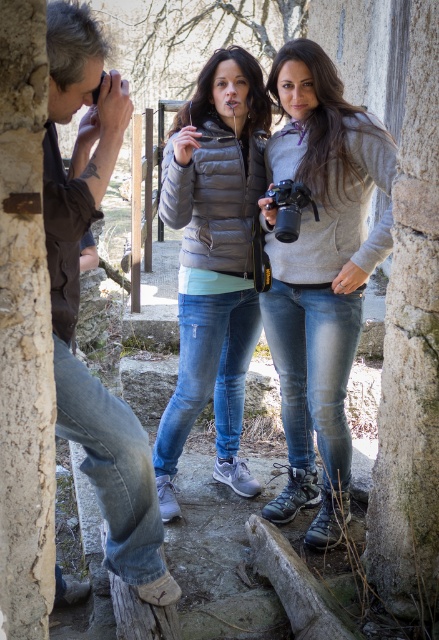
Question: Which point is closer to the camera taking this photo?

Choices:
 (A) (75, 269)
 (B) (351, 332)
 (C) (231, 145)

Answer: (A)

Question: Which object is positioned closest to the black plastic camera at center?

Choices:
 (A) brown leather jacket at left
 (B) gray fleece jacket at center

Answer: (B)

Question: Is brown leather jacket at left wider than black plastic camera at center?

Choices:
 (A) yes
 (B) no

Answer: (A)

Question: Is gray fleece jacket at center closer to camera compared to black plastic camera at center?

Choices:
 (A) yes
 (B) no

Answer: (B)

Question: Does matte gray puffer jacket at center have a smaller size compared to brown leather jacket at left?

Choices:
 (A) no
 (B) yes

Answer: (A)

Question: Among these objects, which one is nearest to the camera?

Choices:
 (A) brown leather jacket at left
 (B) black plastic camera at center
 (C) gray fleece jacket at center
 (D) matte gray puffer jacket at center

Answer: (A)